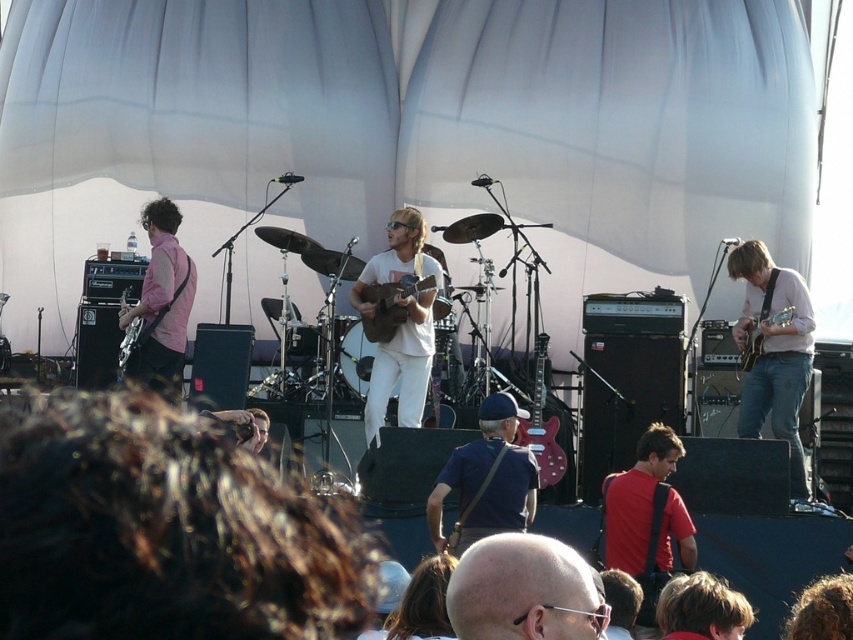
Question: Is the position of pink matte shirt at center less distant than that of glossy wood guitar at center?

Choices:
 (A) yes
 (B) no

Answer: (B)

Question: Is bald head at center wider than pink matte shirt at center?

Choices:
 (A) no
 (B) yes

Answer: (B)

Question: Considering the real-world distances, which object is closest to the glossy wood guitar at center?

Choices:
 (A) matte brown guitar at right
 (B) matte brown guitar at center
 (C) pink matte shirt at left

Answer: (B)

Question: Estimate the real-world distances between objects in this image. Which object is closer to the red matte shirt at center?

Choices:
 (A) matte brown guitar at center
 (B) pink matte shirt at left

Answer: (A)

Question: Can you confirm if pink matte shirt at center is positioned to the right of matte brown guitar at right?

Choices:
 (A) no
 (B) yes

Answer: (B)

Question: Which object appears farthest from the camera in this image?

Choices:
 (A) pink matte shirt at center
 (B) glossy wood guitar at center

Answer: (A)